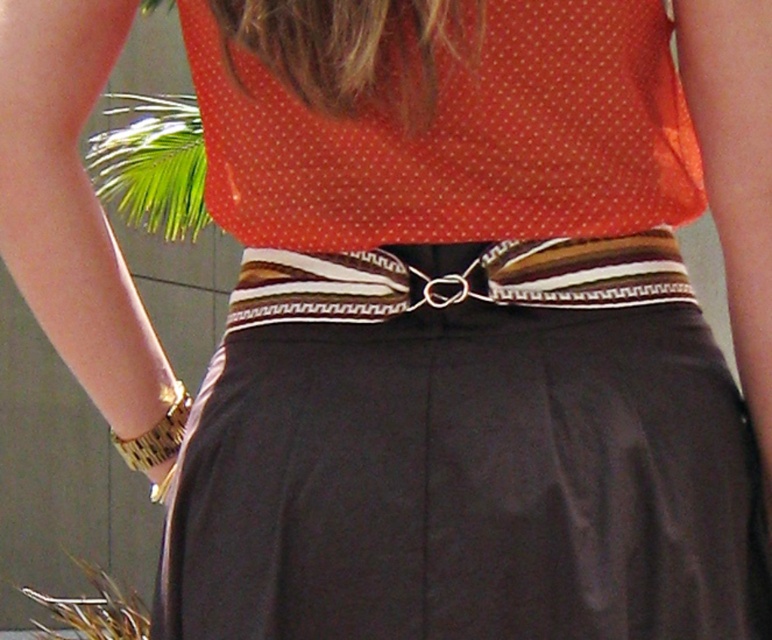
Does orange dotted fabric at upper center have a smaller size compared to striped fabric belt at center?

Incorrect, orange dotted fabric at upper center is not smaller in size than striped fabric belt at center.

Is orange dotted fabric at upper center shorter than striped fabric belt at center?

No.

Where is `orange dotted fabric at upper center`? The image size is (772, 640). orange dotted fabric at upper center is located at coordinates (461, 138).

Between striped fabric belt at center and gold metallic bracelet at lower left, which one has less height?

gold metallic bracelet at lower left is shorter.

Is point (442, 298) farther from viewer compared to point (174, 408)?

No, (442, 298) is closer to viewer.

The width and height of the screenshot is (772, 640). I want to click on striped fabric belt at center, so click(x=456, y=278).

Is point (239, 81) farther from camera compared to point (175, 445)?

No, it is in front of (175, 445).

Who is lower down, orange dotted fabric at upper center or gold metallic bracelet at lower left?

gold metallic bracelet at lower left is below.

Describe the element at coordinates (461, 138) in the screenshot. This screenshot has width=772, height=640. I see `orange dotted fabric at upper center` at that location.

Locate an element on the screen. orange dotted fabric at upper center is located at coordinates (461, 138).